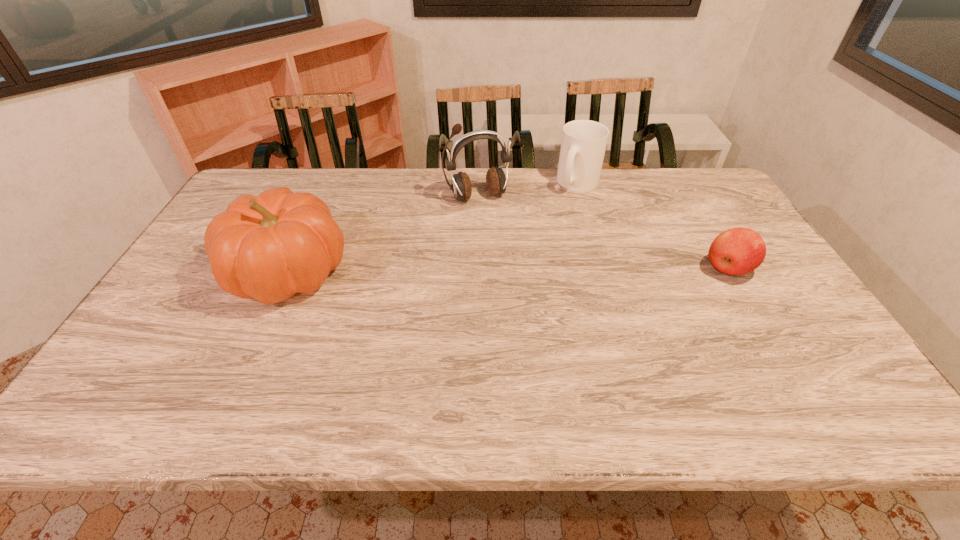
You are a GUI agent. You are given a task and a screenshot of the screen. Output one action in this format:
    pyautogui.click(x=<x>, y=<y>)
    Task: Click on the free spot on the desktop that is between the leftmost object and the apple and is positioned on the ear pads of the earphone
    Image resolution: width=960 pixels, height=540 pixels.
    Given the screenshot: What is the action you would take?
    pyautogui.click(x=514, y=270)

Where is `free space on the desktop that is between the pumpkin and the rightmost object and is positioned on the handle side of the third tallest object`? free space on the desktop that is between the pumpkin and the rightmost object and is positioned on the handle side of the third tallest object is located at coordinates (539, 270).